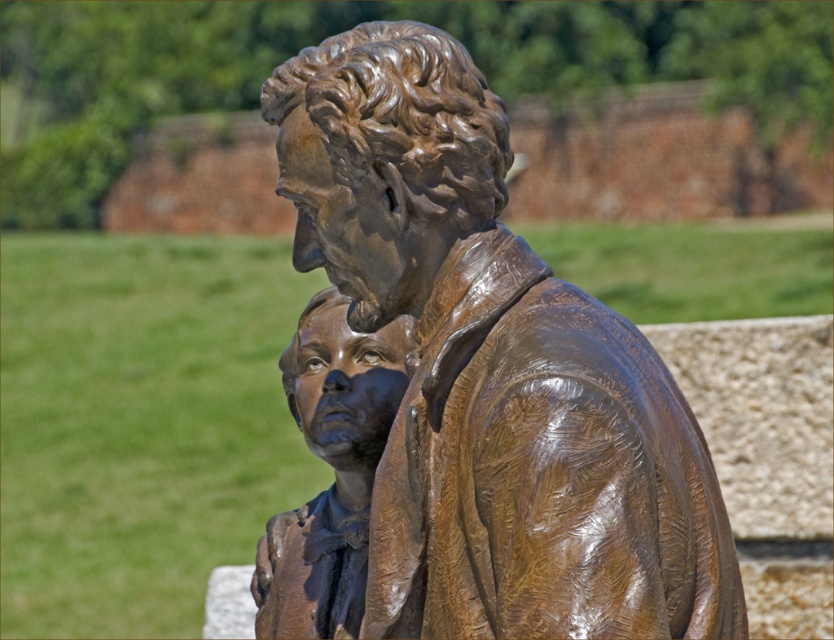
Question: Is shiny bronze statue at center behind bronze statue at center?

Choices:
 (A) no
 (B) yes

Answer: (A)

Question: Does shiny bronze statue at center have a smaller size compared to bronze statue at center?

Choices:
 (A) no
 (B) yes

Answer: (B)

Question: Is shiny bronze statue at center thinner than bronze statue at center?

Choices:
 (A) yes
 (B) no

Answer: (A)

Question: Among these points, which one is farthest from the camera?

Choices:
 (A) (300, 406)
 (B) (606, 586)

Answer: (A)